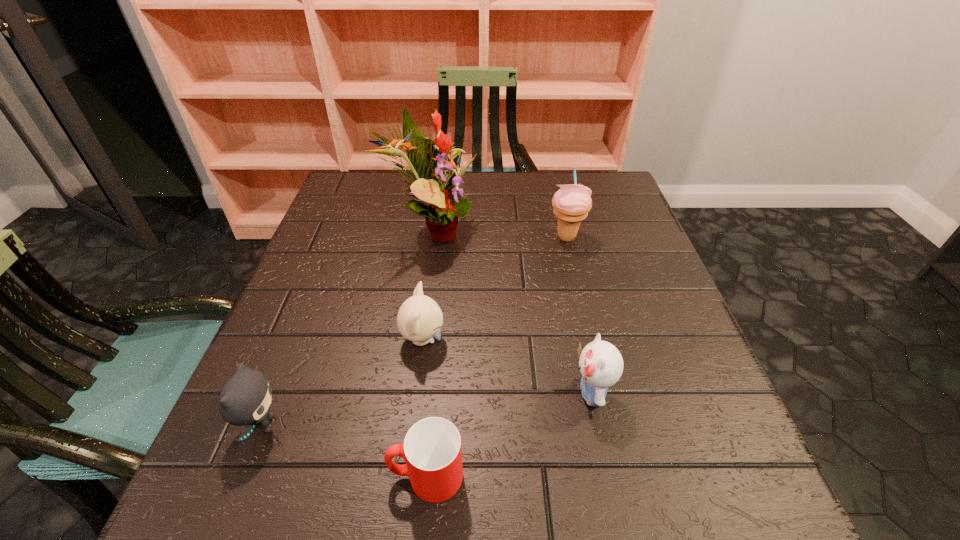
Choose which kitten is the second nearest neighbor to the cup. Please provide its 2D coordinates. Your answer should be formatted as a tuple, i.e. [(x, y)], where the tuple contains the x and y coordinates of a point satisfying the conditions above.

[(245, 399)]

Point out which kitten is positioned as the second nearest to the second kitten from left to right. Please provide its 2D coordinates. Your answer should be formatted as a tuple, i.e. [(x, y)], where the tuple contains the x and y coordinates of a point satisfying the conditions above.

[(601, 365)]

Locate an element on the screen. Image resolution: width=960 pixels, height=540 pixels. vacant position in the image that satisfies the following two spatial constraints: 1. on the front-facing side of the leftmost kitten; 2. on the side of the cup with the handle is located at coordinates (242, 476).

Find the location of a particular element. Image resolution: width=960 pixels, height=540 pixels. vacant space that satisfies the following two spatial constraints: 1. on the side of the fifth shortest object with the handle; 2. on the right side of the cup is located at coordinates pos(447,237).

You are a GUI agent. You are given a task and a screenshot of the screen. Output one action in this format:
    pyautogui.click(x=<x>, y=<y>)
    Task: Click on the free location that satisfies the following two spatial constraints: 1. on the front side of the icecream; 2. on the face of the third farthest object
    
    Given the screenshot: What is the action you would take?
    pos(591,340)

The width and height of the screenshot is (960, 540). Find the location of `vacant space that satisfies the following two spatial constraints: 1. on the face of the farthest kitten; 2. on the side of the cup with the handle`. vacant space that satisfies the following two spatial constraints: 1. on the face of the farthest kitten; 2. on the side of the cup with the handle is located at coordinates (405, 476).